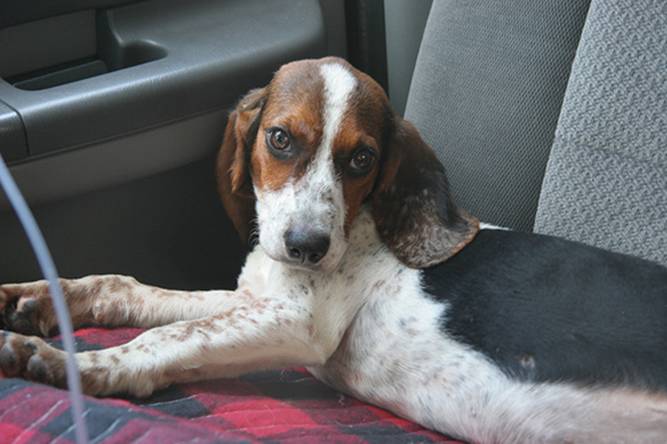
In order to click on light grey back of chair in this screenshot , I will do `click(631, 77)`.